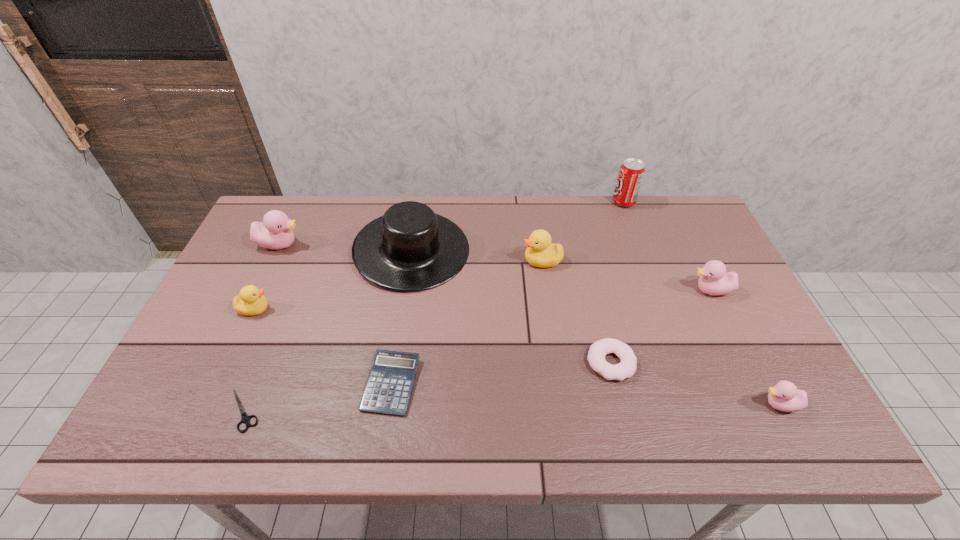
At what (x,y) coordinates should I click in order to perform the action: click on the third closest pink duckling to the soda. Please return your answer as a coordinate pair (x, y). This screenshot has height=540, width=960. Looking at the image, I should click on (275, 232).

You are a GUI agent. You are given a task and a screenshot of the screen. Output one action in this format:
    pyautogui.click(x=<x>, y=<y>)
    Task: Click on the pink duckling object that ranks as the second closest to the shears
    Image resolution: width=960 pixels, height=540 pixels.
    Given the screenshot: What is the action you would take?
    pyautogui.click(x=714, y=280)

You are a GUI agent. You are given a task and a screenshot of the screen. Output one action in this format:
    pyautogui.click(x=<x>, y=<y>)
    Task: Click on the vacant space that satisfies the following two spatial constraints: 1. on the front-facing side of the biggest pink duckling; 2. on the right side of the black shears
    
    Given the screenshot: What is the action you would take?
    pyautogui.click(x=203, y=410)

Image resolution: width=960 pixels, height=540 pixels. Find the location of `free space that satisfies the following two spatial constraints: 1. on the face of the smaller yellow duckling; 2. on the left side of the black shears`. free space that satisfies the following two spatial constraints: 1. on the face of the smaller yellow duckling; 2. on the left side of the black shears is located at coordinates (207, 410).

The height and width of the screenshot is (540, 960). What are the coordinates of `free location that satisfies the following two spatial constraints: 1. on the face of the seventh object from left to right; 2. on the right side of the left yellow duckling` in the screenshot? It's located at (229, 362).

Where is `vacant position in the image that satisfies the following two spatial constraints: 1. on the front-facing side of the second shortest object; 2. on the left side of the leftmost pink duckling`? vacant position in the image that satisfies the following two spatial constraints: 1. on the front-facing side of the second shortest object; 2. on the left side of the leftmost pink duckling is located at coordinates (214, 384).